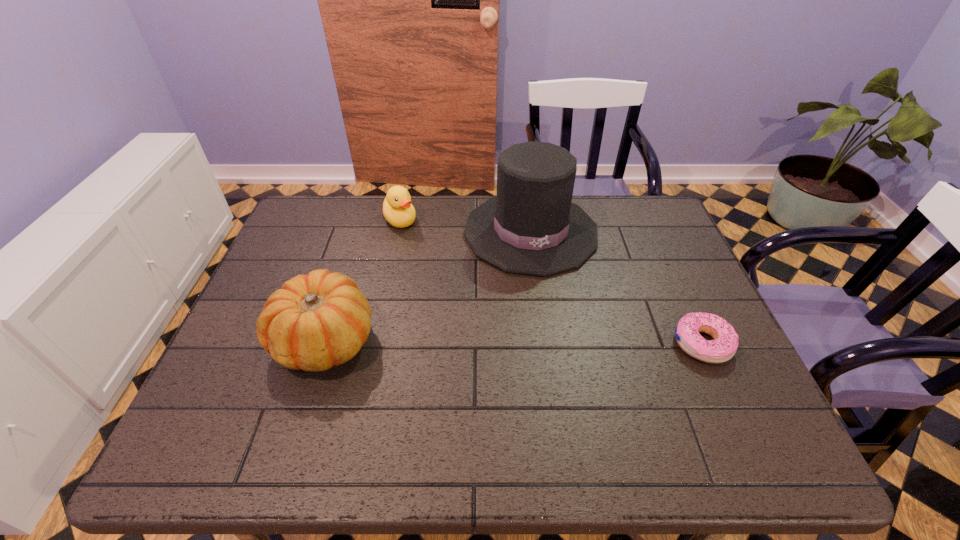
You are a GUI agent. You are given a task and a screenshot of the screen. Output one action in this format:
    pyautogui.click(x=<x>, y=<y>)
    Task: Click on the free space between the gourd and the second object from right to left
    The width and height of the screenshot is (960, 540).
    Given the screenshot: What is the action you would take?
    pyautogui.click(x=428, y=286)

This screenshot has height=540, width=960. Identify the location of blank region between the third tallest object and the tallest object. pos(466,226).

Find the location of a particular element. The height and width of the screenshot is (540, 960). vacant region between the shortest object and the duckling is located at coordinates (551, 281).

Locate an element on the screen. free area in between the rightmost object and the gourd is located at coordinates (514, 342).

Identify the location of unoccupied position between the rightmost object and the third tallest object. The height and width of the screenshot is (540, 960). click(x=551, y=281).

Identify the location of object that stands as the second closest to the shortest object. This screenshot has width=960, height=540. (314, 322).

At what (x,y) coordinates should I click in order to perform the action: click on object identified as the second closest to the rightmost object. Please return your answer as a coordinate pair (x, y). Looking at the image, I should click on (314, 322).

I want to click on vacant space that satisfies the following two spatial constraints: 1. on the front side of the third object from left to right; 2. on the right side of the duckling, so click(397, 232).

Locate an element on the screen. The width and height of the screenshot is (960, 540). free location that satisfies the following two spatial constraints: 1. on the back side of the third shortest object; 2. on the right side of the duckling is located at coordinates (364, 219).

The height and width of the screenshot is (540, 960). In order to click on vacant space that satisfies the following two spatial constraints: 1. on the back side of the tallest object; 2. on the right side of the gourd in this screenshot , I will do `click(359, 232)`.